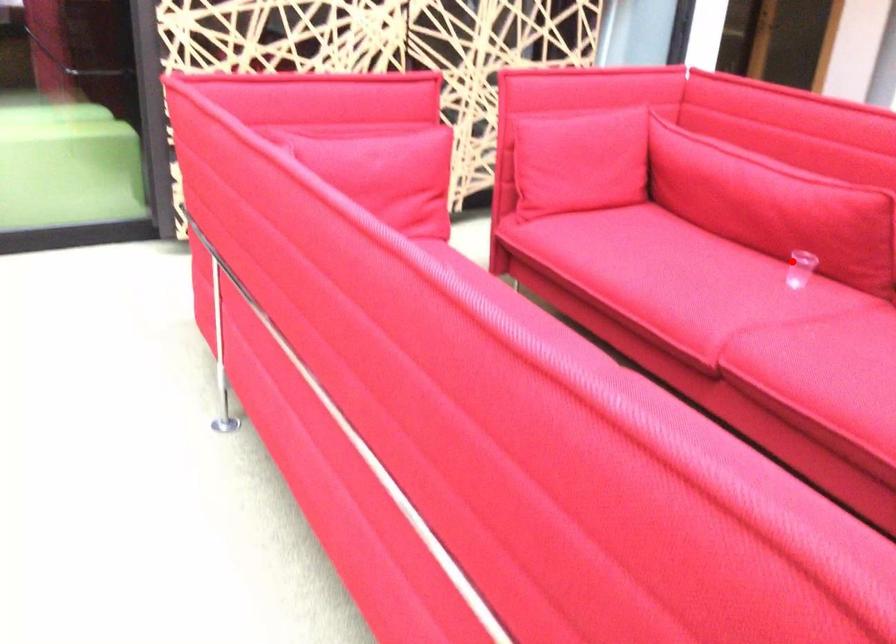
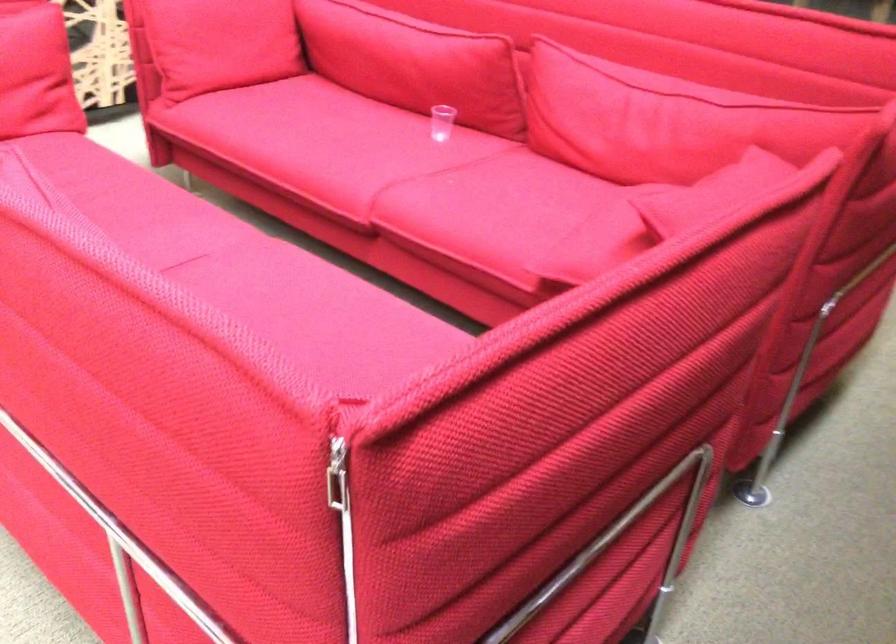
Question: I am providing you with two images of the same scene from different viewpoints. A red point is marked on the first image. Can you still see the location of the red point in image 2?

Choices:
 (A) Yes
 (B) No

Answer: (A)